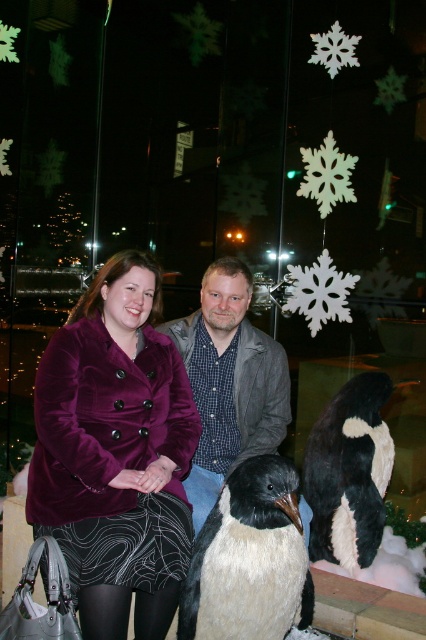
Question: Is velvet gray jacket at center thinner than black and white fur penguin at lower center?

Choices:
 (A) yes
 (B) no

Answer: (B)

Question: Which point is closer to the camera taking this photo?

Choices:
 (A) (235, 424)
 (B) (321, 461)
 (C) (282, 628)
 (D) (48, 525)

Answer: (C)

Question: Which is farther from the white soft penguin at center?

Choices:
 (A) velvet purple coat at center
 (B) black and white fur penguin at lower center

Answer: (B)

Question: Can you confirm if velvet purple coat at center is wider than velvet gray jacket at center?

Choices:
 (A) yes
 (B) no

Answer: (A)

Question: Is velvet purple coat at center to the left of black and white fur penguin at lower center from the viewer's perspective?

Choices:
 (A) yes
 (B) no

Answer: (A)

Question: Estimate the real-world distances between objects in this image. Which object is farther from the velvet gray jacket at center?

Choices:
 (A) white soft penguin at center
 (B) black and white fur penguin at lower center

Answer: (A)